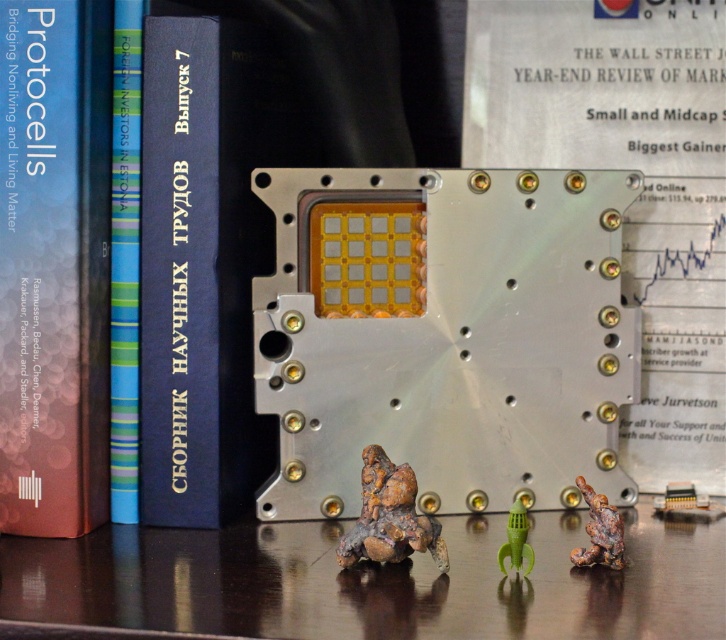
You are organizing a desk and need to place the metallic silver at center and the rusty metal figure at lower right. Based on their positions, which object is closer to the edge of the desk?

The rusty metal figure at lower right is closer to the edge of the desk since it is positioned below the metallic silver at center, which is above it.

You have a small toy car that is 10 centimeters long. You want to move it from the metallic silver at center to the rusty metal figure at lower right. Can it travel the entire distance without any obstacles?

The distance between the metallic silver at center and the rusty metal figure at lower right is 20.49 centimeters, so the 10 centimeter toy car can easily travel the entire distance without any issues.